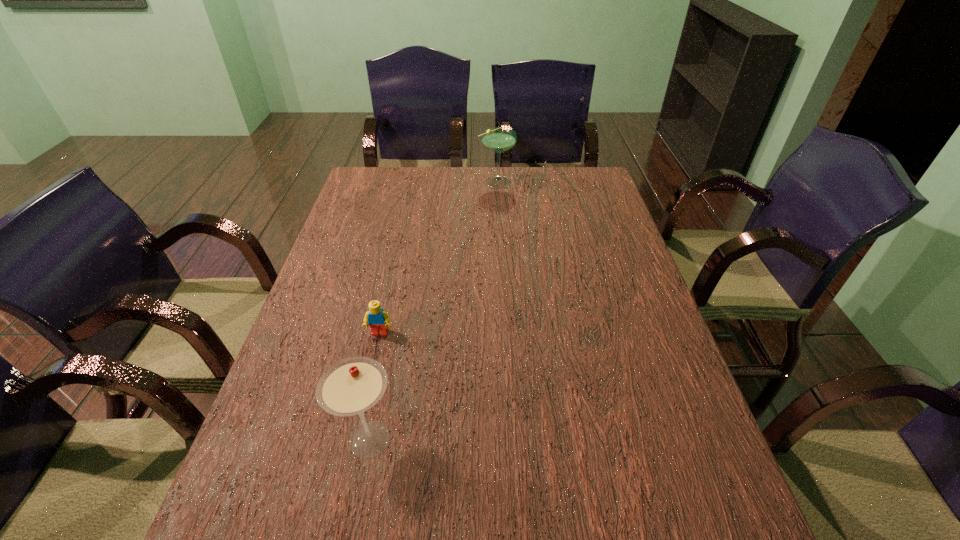
Find the location of a particular element. This screenshot has width=960, height=540. vacant space that is in between the nearest object and the farther martini is located at coordinates (433, 310).

Locate which object ranks second in proximity to the farthest object. Please provide its 2D coordinates. Your answer should be formatted as a tuple, i.e. [(x, y)], where the tuple contains the x and y coordinates of a point satisfying the conditions above.

[(351, 386)]

The width and height of the screenshot is (960, 540). In order to click on object that is the closest to the farthest object in this screenshot , I will do `click(378, 320)`.

At what (x,y) coordinates should I click in order to perform the action: click on vacant space that satisfies the following two spatial constraints: 1. on the front-facing side of the nearest object; 2. on the left side of the Lego. Please return your answer as a coordinate pair (x, y). Looking at the image, I should click on (356, 439).

I want to click on free spot that satisfies the following two spatial constraints: 1. on the front-facing side of the nearest object; 2. on the left side of the shortest object, so click(x=356, y=439).

What are the coordinates of `vacant area that satisfies the following two spatial constraints: 1. on the front-facing side of the nearest object; 2. on the left side of the shortest object` in the screenshot? It's located at (356, 439).

Where is `vacant position in the image that satisfies the following two spatial constraints: 1. on the front-facing side of the nearest object; 2. on the left side of the shortest object`? This screenshot has width=960, height=540. vacant position in the image that satisfies the following two spatial constraints: 1. on the front-facing side of the nearest object; 2. on the left side of the shortest object is located at coordinates (356, 439).